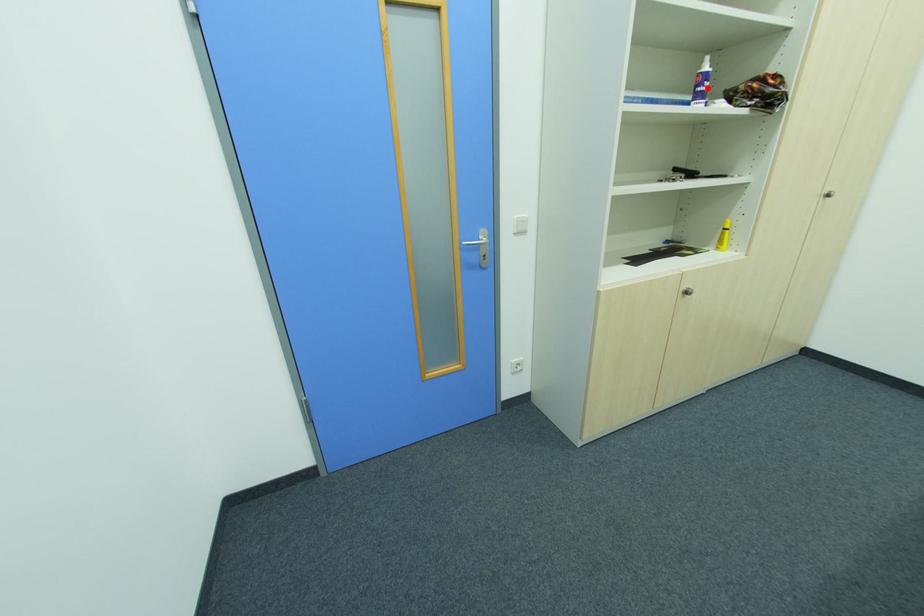
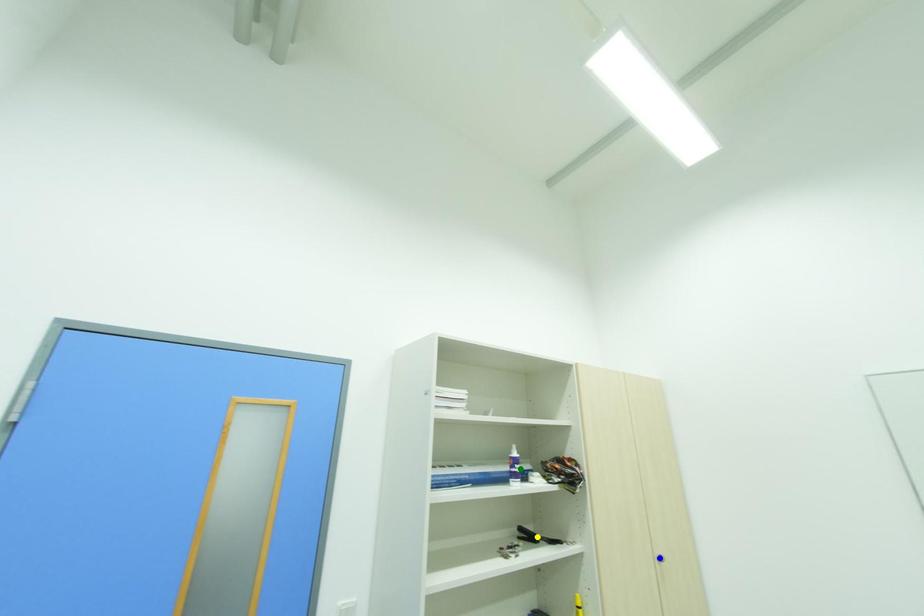
Question: I am providing you with two images of the same scene from different viewpoints. A red point is marked on the first image. You are given multiple points on the second image. In image 2, which mark is for the same physical point as the one in image 1?

Choices:
 (A) blue point
 (B) green point
 (C) yellow point

Answer: (B)